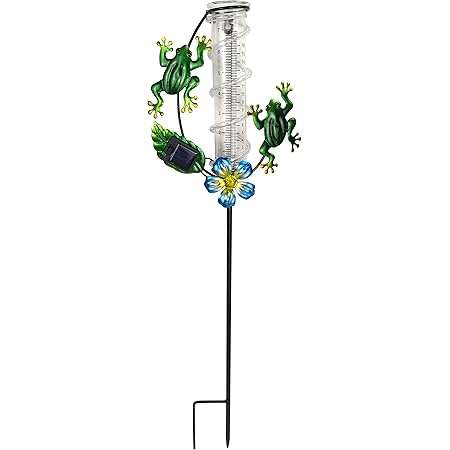
Find the location of `cable`. cable is located at coordinates (177, 105).